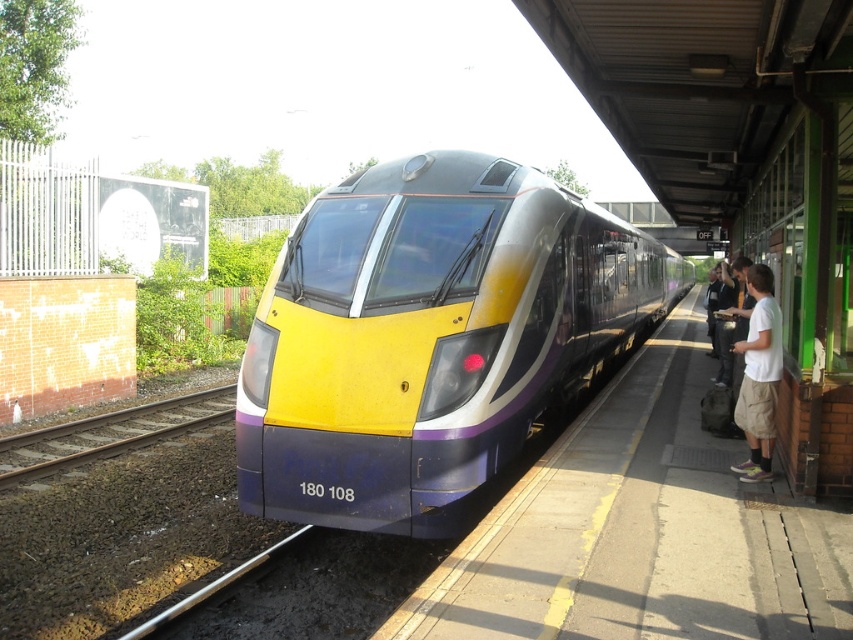
Is brown gravel train track at lower left positioned in front of dark gray pants at platform right?

Yes, it is.

Locate an element on the screen. The height and width of the screenshot is (640, 853). brown gravel train track at lower left is located at coordinates (109, 433).

In order to click on brown gravel train track at lower left in this screenshot , I will do `click(109, 433)`.

Is point (769, 300) behind point (730, 305)?

No.

Can you confirm if white cotton shirt at right is smaller than dark gray pants at platform right?

Actually, white cotton shirt at right might be larger than dark gray pants at platform right.

Who is more forward, (763, 436) or (718, 380)?

Point (763, 436) is in front.

You are a GUI agent. You are given a task and a screenshot of the screen. Output one action in this format:
    pyautogui.click(x=<x>, y=<y>)
    Task: Click on the white cotton shirt at right
    
    Given the screenshot: What is the action you would take?
    pyautogui.click(x=758, y=376)

In the scene shown: Does brown gravel train track at lower left have a lesser height compared to white cotton shirt at right?

Yes.

Does point (3, 445) come farther from viewer compared to point (750, 276)?

Yes.

Identify the location of brown gravel train track at lower left. (109, 433).